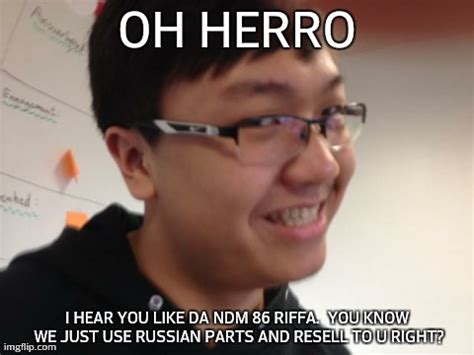
Locate post it in the image. Your answer should be formatted as a list of tuples, i.e. [(x1, y1), (x2, y2), ...], where each tuple contains the x and y coordinates of a point satisfying the conditions above.

[(71, 163)]